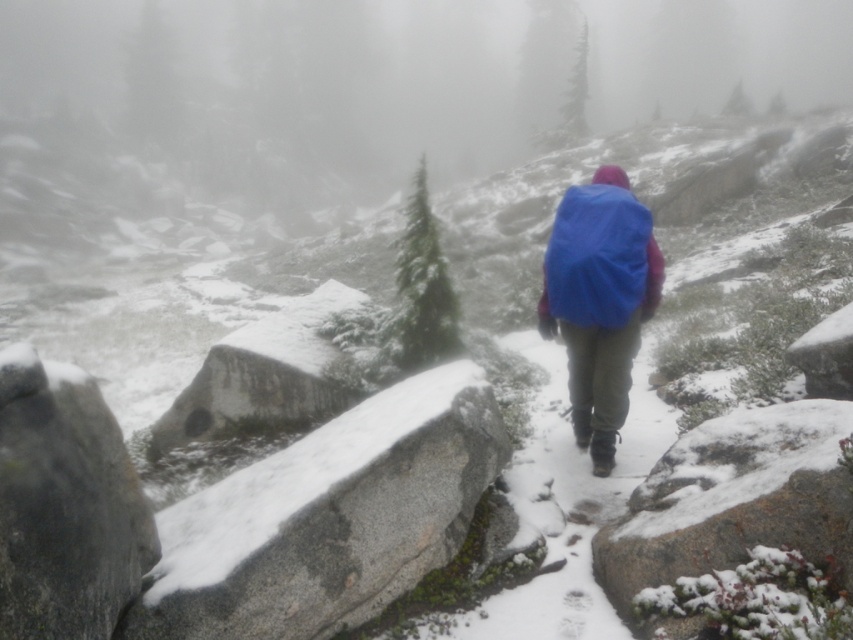
You are the hiker in the image. You need to place your blue fabric backpack at center on the ground. Is the gray granite boulder at lower left in the way of placing it there?

The gray granite boulder at lower left is located below the blue fabric backpack at center, so placing the backpack there would not be obstructed by the boulder since it is positioned lower down.

You are a hiker trying to cross the rocky trail. You notice a granite boulder at lower left and a blue matte jacket at center. Which object is wider?

The granite boulder at lower left is wider than the blue matte jacket at center.